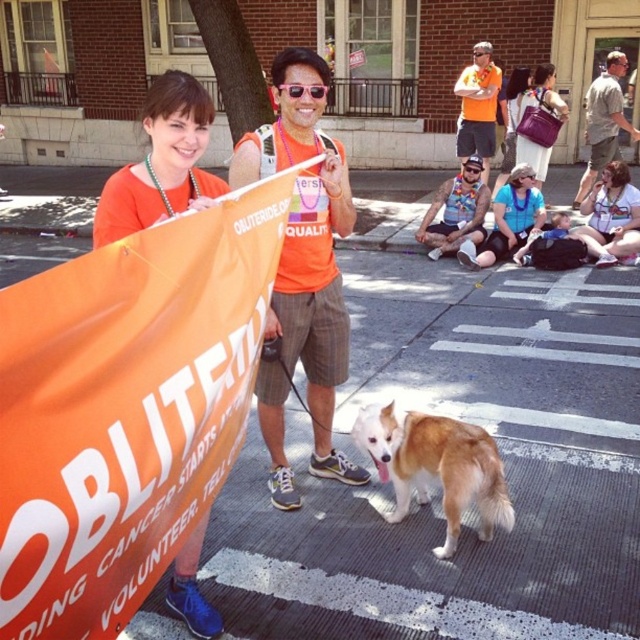
Question: Can you confirm if brown and white fur dog at center is bigger than orange fabric at upper center?

Choices:
 (A) no
 (B) yes

Answer: (A)

Question: Which point is closer to the camera taking this photo?

Choices:
 (A) (460, 147)
 (B) (125, 620)

Answer: (B)

Question: Which of the following is the farthest from the observer?

Choices:
 (A) black plastic goggles at center
 (B) orange fabric banner at center
 (C) brown and white fur dog at center
 (D) sunglasses at center

Answer: (A)

Question: Does orange fabric banner at center lie in front of sunglasses at center?

Choices:
 (A) yes
 (B) no

Answer: (A)

Question: Can you confirm if brown and white fur dog at center is smaller than black plastic goggles at center?

Choices:
 (A) yes
 (B) no

Answer: (B)

Question: Considering the real-world distances, which object is closest to the orange fabric banner at center?

Choices:
 (A) black plastic goggles at center
 (B) orange fabric at center

Answer: (B)